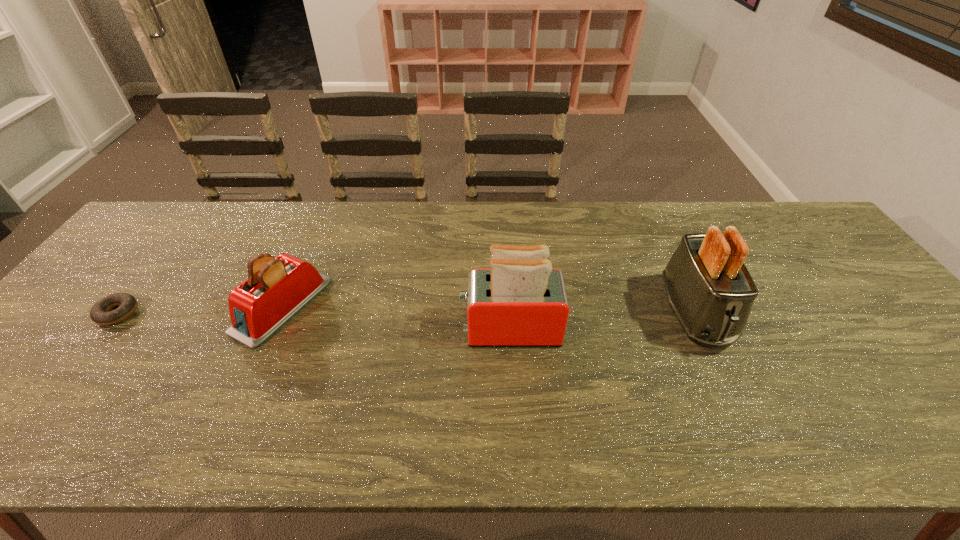
Find the location of a particular element. the rightmost object is located at coordinates (711, 292).

Identify the location of the second object from right to left. (521, 301).

Where is `the shortest toaster`? This screenshot has width=960, height=540. the shortest toaster is located at coordinates (277, 288).

Find the location of a particular element. the leftmost toaster is located at coordinates (277, 288).

You are a GUI agent. You are given a task and a screenshot of the screen. Output one action in this format:
    pyautogui.click(x=<x>, y=<y>)
    Task: Click on the leftmost object
    The width and height of the screenshot is (960, 540).
    Given the screenshot: What is the action you would take?
    pyautogui.click(x=99, y=314)

Identify the location of the shortest object. (x=99, y=314).

In order to click on free spot located on the side of the rightmost toaster with the control lever in this screenshot , I will do `click(725, 379)`.

The image size is (960, 540). What are the coordinates of `free space located 0.100m on the front-facing side of the second object from right to left` in the screenshot? It's located at (421, 329).

In order to click on vacant space situated on the front-facing side of the second object from right to left in this screenshot , I will do `click(390, 329)`.

Find the location of a particular element. This screenshot has width=960, height=540. vacant area situated 0.270m on the front-facing side of the second object from right to left is located at coordinates (353, 329).